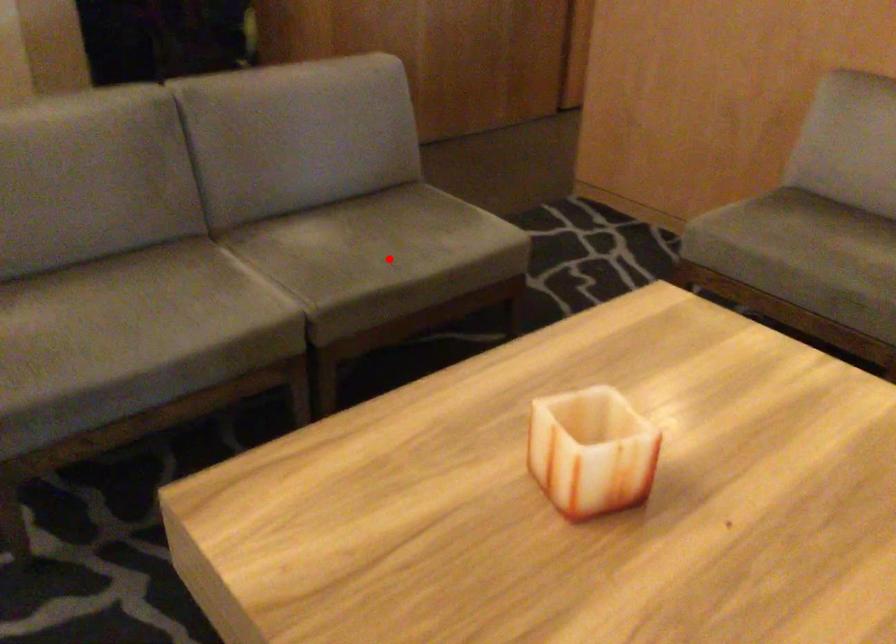
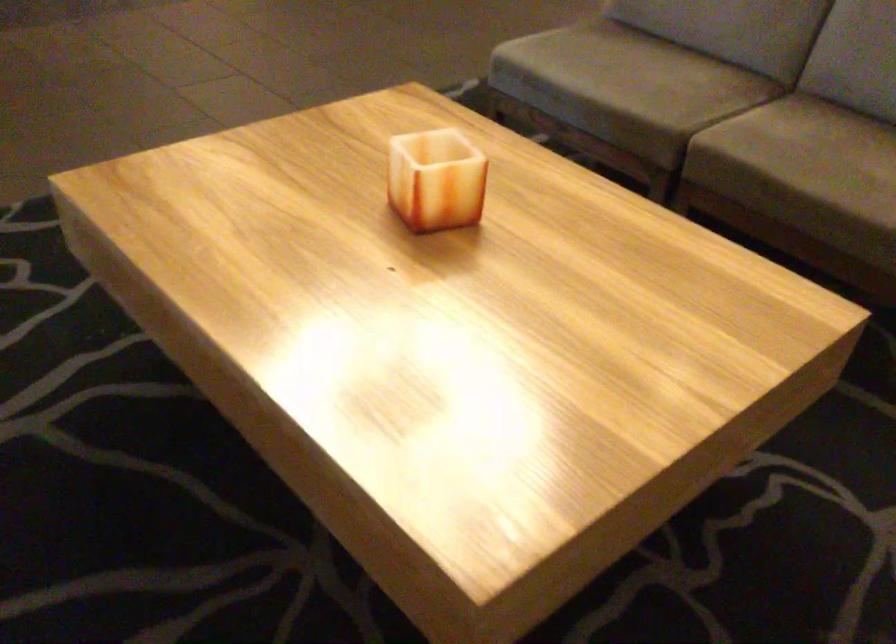
Locate, in the second image, the point that corresponds to the highlighted location in the first image.

(800, 161)